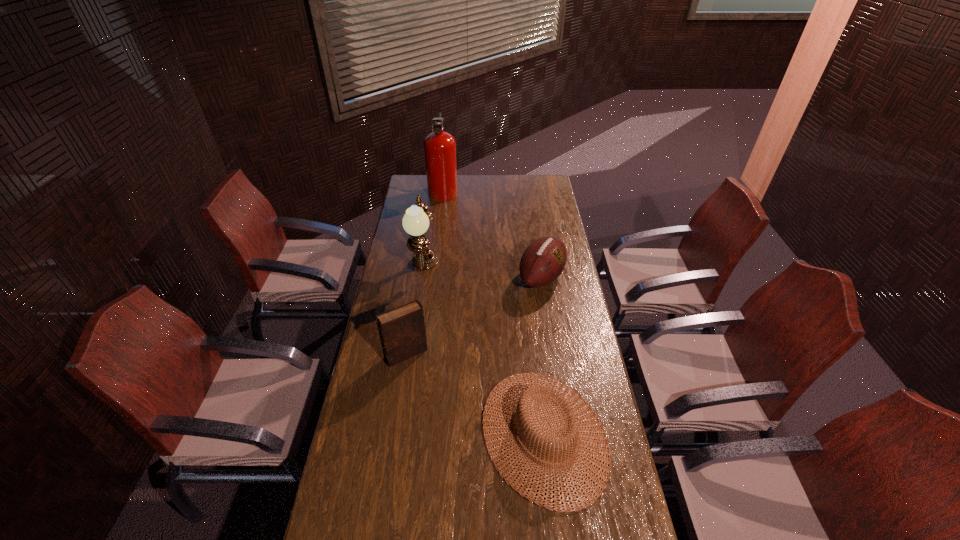
Where is `empty space that is in between the oil lamp and the football (American)`? This screenshot has height=540, width=960. empty space that is in between the oil lamp and the football (American) is located at coordinates (483, 274).

At what (x,y) coordinates should I click in order to perform the action: click on vacant space that's between the nearest object and the farthest object. Please return your answer as a coordinate pair (x, y). The width and height of the screenshot is (960, 540). Looking at the image, I should click on (493, 313).

I want to click on free space that is in between the oil lamp and the tallest object, so click(434, 231).

The width and height of the screenshot is (960, 540). Find the location of `the second closest object to the farthest object`. the second closest object to the farthest object is located at coordinates (543, 261).

Locate which object is the third closest to the nearest object. Please provide its 2D coordinates. Your answer should be formatted as a tuple, i.e. [(x, y)], where the tuple contains the x and y coordinates of a point satisfying the conditions above.

[(415, 222)]

In order to click on free location that satisfies the following two spatial constraints: 1. on the back side of the fourth tallest object; 2. on the left side of the fourth farthest object in this screenshot , I will do tap(419, 278).

Locate an element on the screen. The height and width of the screenshot is (540, 960). free space that satisfies the following two spatial constraints: 1. with the handle and nozzle on the nearest object; 2. on the left side of the farthest object is located at coordinates (415, 434).

This screenshot has width=960, height=540. Identify the location of free space that satisfies the following two spatial constraints: 1. with the handle and nozzle on the tallest object; 2. on the left side of the second shortest object. (433, 278).

Find the location of a particular element. The height and width of the screenshot is (540, 960). free spot that satisfies the following two spatial constraints: 1. on the front side of the fourth tallest object; 2. on the right side of the oil lamp is located at coordinates (423, 278).